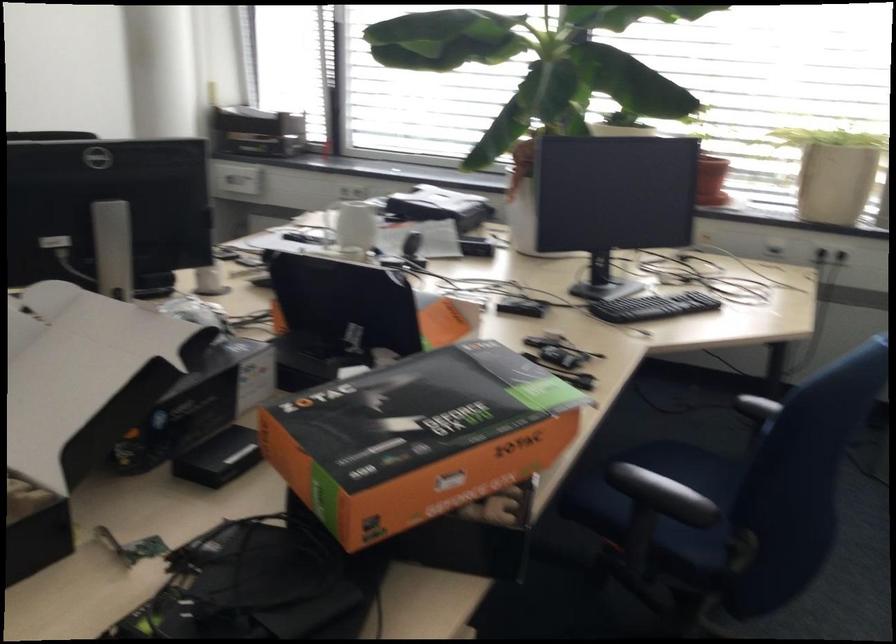
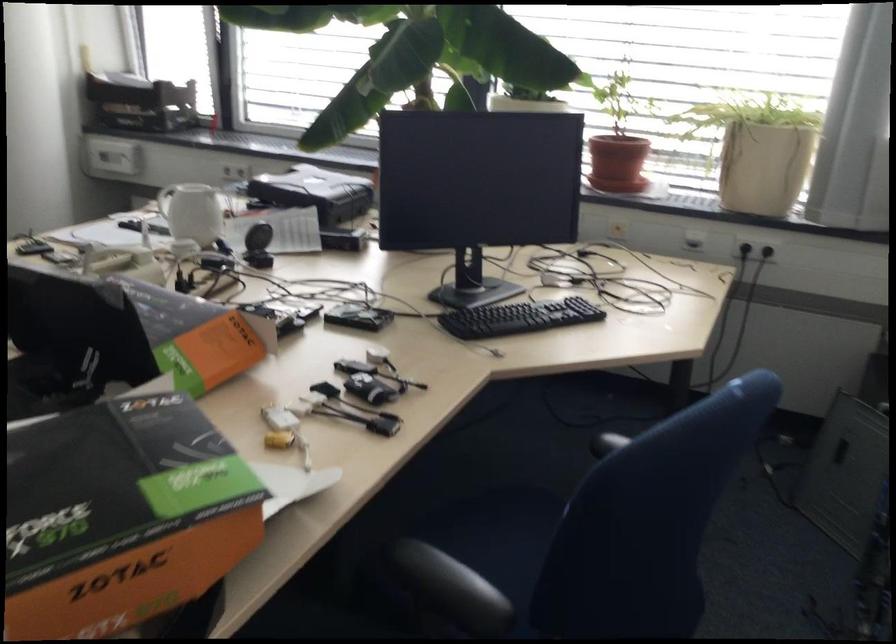
The point at (330, 207) is marked in the first image. Where is the corresponding point in the second image?

(165, 200)